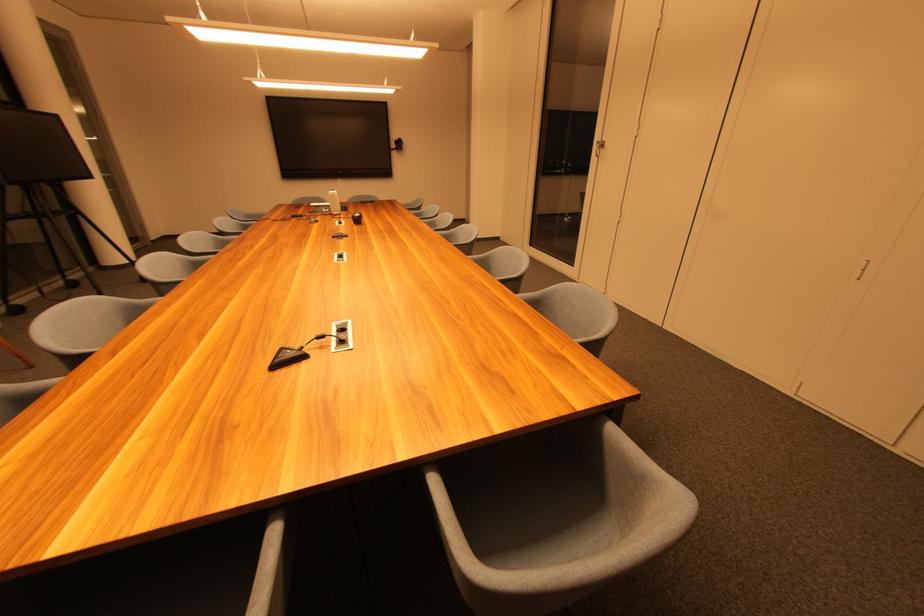
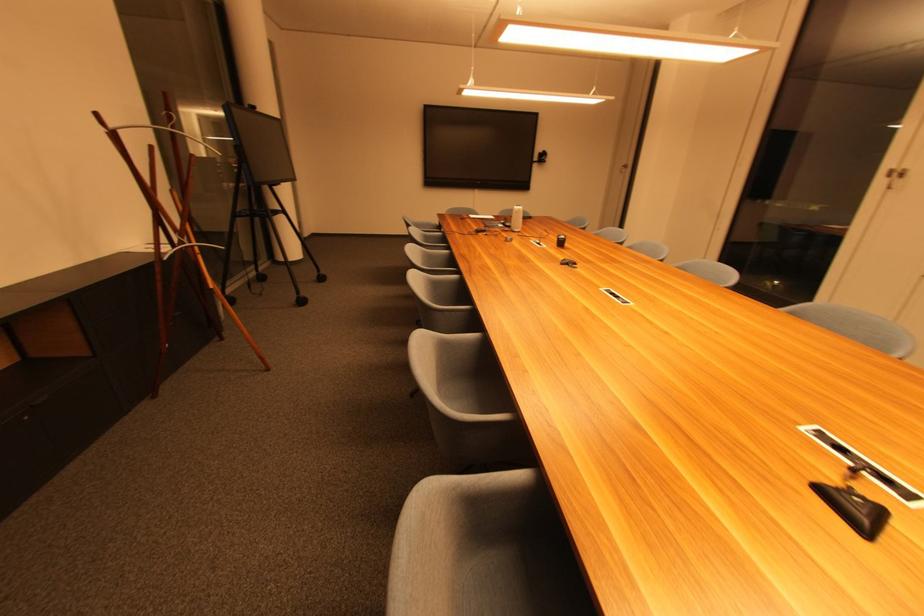
Where in the second image is the point corresponding to point 335,198 from the first image?

(521, 214)